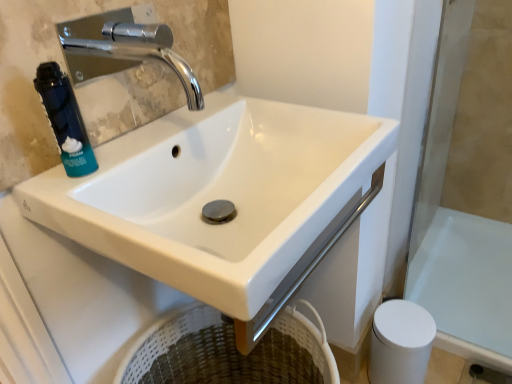
What are the coordinates of `empty space that is ontop of white matte toilet paper at lower right (from a real-world perspective)` in the screenshot? It's located at (404, 325).